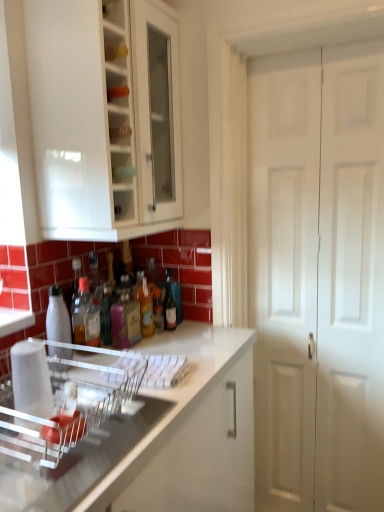
Measure the distance between point (85,291) and camera.

A distance of 1.50 meters exists between point (85,291) and camera.

What are the coordinates of `pink matte bottle at center, marked as the 4th bottle in a right-to-left arrangement` in the screenshot? It's located at (125, 317).

The height and width of the screenshot is (512, 384). Describe the element at coordinates (146, 306) in the screenshot. I see `translucent glass bottle at center, the fourth bottle viewed from the left` at that location.

In the scene shown: How much space does translucent glass bottle at center, the 3th bottle when ordered from right to left, occupy vertically?

It is 22.80 centimeters.

The height and width of the screenshot is (512, 384). What are the coordinates of `translucent plastic bottle at center, positioned as the 5th bottle in left-to-right order` in the screenshot? It's located at (158, 310).

The image size is (384, 512). Identify the location of clear plastic dish rack at center. (61, 401).

This screenshot has height=512, width=384. What do you see at coordinates (61, 401) in the screenshot? I see `clear plastic dish rack at center` at bounding box center [61, 401].

The width and height of the screenshot is (384, 512). What are the coordinates of `translucent plastic bottle at center, the second bottle in the left-to-right sequence` in the screenshot? It's located at (80, 311).

Considering the positions of objects translucent plastic bottle at center, the fifth bottle in the right-to-left sequence, and white glossy bottle at center, the 1th bottle from the left, in the image provided, who is behind, translucent plastic bottle at center, the fifth bottle in the right-to-left sequence, or white glossy bottle at center, the 1th bottle from the left,?

translucent plastic bottle at center, the fifth bottle in the right-to-left sequence.

Is there a large distance between translucent plastic bottle at center, the fifth bottle in the right-to-left sequence, and white glossy bottle at center, the 1th bottle from the left?

Actually, translucent plastic bottle at center, the fifth bottle in the right-to-left sequence, and white glossy bottle at center, the 1th bottle from the left, are a little close together.

Who is taller, translucent plastic bottle at center, the second bottle in the left-to-right sequence, or white glossy bottle at center, arranged as the sixth bottle when viewed from the right?

translucent plastic bottle at center, the second bottle in the left-to-right sequence.

Is translucent glass bottle at center, the 3th bottle when ordered from right to left, in contact with matte glass bottle at center, the sixth bottle when ordered from left to right?

Yes, translucent glass bottle at center, the 3th bottle when ordered from right to left, is right next to matte glass bottle at center, the sixth bottle when ordered from left to right, and making contact.

What's the angular difference between translucent glass bottle at center, the fourth bottle viewed from the left, and matte glass bottle at center, which appears as the first bottle when viewed from the right,'s facing directions?

The facing directions of translucent glass bottle at center, the fourth bottle viewed from the left, and matte glass bottle at center, which appears as the first bottle when viewed from the right, are 0.00762 degrees apart.

In terms of height, does translucent glass bottle at center, the 3th bottle when ordered from right to left, look taller or shorter compared to matte glass bottle at center, which appears as the first bottle when viewed from the right?

translucent glass bottle at center, the 3th bottle when ordered from right to left, is taller than matte glass bottle at center, which appears as the first bottle when viewed from the right.

Considering the points (144, 284) and (165, 300), which point is behind, point (144, 284) or point (165, 300)?

The point (165, 300) is farther.

Identify the location of appliance on the left side of matte glass bottle at center, which appears as the first bottle when viewed from the right. This screenshot has height=512, width=384. (61, 401).

Which point is more distant from viewer, (166, 300) or (113, 391)?

The point (166, 300) is farther.

Is matte glass bottle at center, the sixth bottle when ordered from left to right, in front of or behind clear plastic dish rack at center in the image?

In the image, matte glass bottle at center, the sixth bottle when ordered from left to right, appears behind clear plastic dish rack at center.

From the image's perspective, is clear plastic dish rack at lower left over clear plastic dish rack at center?

No.

Which point is more distant from viewer, (x=56, y=504) or (x=63, y=439)?

The point (x=63, y=439) is farther.

Between clear plastic dish rack at lower left and clear plastic dish rack at center, which one has smaller size?

With smaller size is clear plastic dish rack at center.

From a real-world perspective, which object rests below the other?

clear plastic dish rack at lower left is physically lower.

Considering the sizes of clear plastic dish rack at lower left and white glossy cabinet at upper left in the image, is clear plastic dish rack at lower left wider or thinner than white glossy cabinet at upper left?

Considering their sizes, clear plastic dish rack at lower left looks broader than white glossy cabinet at upper left.

Could you tell me if clear plastic dish rack at lower left is facing white glossy cabinet at upper left?

No, clear plastic dish rack at lower left is not oriented towards white glossy cabinet at upper left.

In the scene shown: Considering the relative positions of clear plastic dish rack at lower left and white glossy cabinet at upper left in the image provided, is clear plastic dish rack at lower left to the left or to the right of white glossy cabinet at upper left?

Clearly, clear plastic dish rack at lower left is on the left of white glossy cabinet at upper left in the image.

Is white matte door at right to the right of white glossy cabinet at upper left from the viewer's perspective?

Indeed, white matte door at right is positioned on the right side of white glossy cabinet at upper left.

From the image's perspective, is white matte door at right on white glossy cabinet at upper left?

Incorrect, from the image's perspective, white matte door at right is lower than white glossy cabinet at upper left.

How different are the orientations of white matte door at right and white glossy cabinet at upper left in degrees?

The facing directions of white matte door at right and white glossy cabinet at upper left are 90 degrees apart.

Considering the sizes of objects white matte door at right and white glossy cabinet at upper left in the image provided, who is thinner, white matte door at right or white glossy cabinet at upper left?

white matte door at right.

From the image's perspective, which one is positioned higher, translucent plastic bottle at center, which is counted as the second bottle, starting from the right, or pink matte bottle at center, the third bottle in the left-to-right sequence?

translucent plastic bottle at center, which is counted as the second bottle, starting from the right, is shown above in the image.

From a real-world perspective, relative to pink matte bottle at center, the third bottle in the left-to-right sequence, is translucent plastic bottle at center, which is counted as the second bottle, starting from the right, vertically above or below?

In terms of real-world spatial position, translucent plastic bottle at center, which is counted as the second bottle, starting from the right, is below pink matte bottle at center, the third bottle in the left-to-right sequence.

Is pink matte bottle at center, the third bottle in the left-to-right sequence, at the back of translucent plastic bottle at center, which is counted as the second bottle, starting from the right?

That's not correct — translucent plastic bottle at center, which is counted as the second bottle, starting from the right, is not looking away from pink matte bottle at center, the third bottle in the left-to-right sequence.

Consider the image. Is translucent plastic bottle at center, positioned as the 5th bottle in left-to-right order, further to the viewer compared to pink matte bottle at center, marked as the 4th bottle in a right-to-left arrangement?

Yes.

From a real-world perspective, which bottle is the 1st one underneath the translucent plastic bottle at center, the second bottle in the left-to-right sequence? Please provide its 2D coordinates.

[(57, 317)]

From the image's perspective, starting from the matte glass bottle at center, which appears as the first bottle when viewed from the right, which bottle is the 1st one above? Please provide its 2D coordinates.

[(146, 306)]

From the image, which object appears to be nearer to translucent plastic bottle at center, which is counted as the second bottle, starting from the right, translucent glass bottle at center, the fourth bottle viewed from the left, or translucent plastic bottle at center, the fifth bottle in the right-to-left sequence?

Among the two, translucent glass bottle at center, the fourth bottle viewed from the left, is located nearer to translucent plastic bottle at center, which is counted as the second bottle, starting from the right.

Estimate the real-world distances between objects in this image. Which object is closer to white glossy cabinet at upper left, white glossy bottle at center, arranged as the sixth bottle when viewed from the right, or matte glass bottle at center, the sixth bottle when ordered from left to right?

Among the two, white glossy bottle at center, arranged as the sixth bottle when viewed from the right, is located nearer to white glossy cabinet at upper left.

Looking at the image, which one is located further to clear plastic dish rack at lower left, translucent plastic bottle at center, the fifth bottle in the right-to-left sequence, or translucent plastic bottle at center, which is counted as the second bottle, starting from the right?

Among the two, translucent plastic bottle at center, the fifth bottle in the right-to-left sequence, is located further to clear plastic dish rack at lower left.

When comparing their distances from translucent plastic bottle at center, the fifth bottle in the right-to-left sequence, does clear plastic dish rack at center or matte glass bottle at center, the sixth bottle when ordered from left to right, seem closer?

matte glass bottle at center, the sixth bottle when ordered from left to right.

Based on their spatial positions, is translucent glass bottle at center, the 3th bottle when ordered from right to left, or translucent plastic bottle at center, the fifth bottle in the right-to-left sequence, further from clear plastic dish rack at center?

translucent glass bottle at center, the 3th bottle when ordered from right to left, lies further to clear plastic dish rack at center than the other object.

From the image, which object appears to be nearer to clear plastic dish rack at lower left, translucent plastic bottle at center, the fifth bottle in the right-to-left sequence, or white matte door at right?

Based on the image, translucent plastic bottle at center, the fifth bottle in the right-to-left sequence, appears to be nearer to clear plastic dish rack at lower left.

Looking at the image, which one is located closer to clear plastic dish rack at center, translucent plastic bottle at center, the fifth bottle in the right-to-left sequence, or pink matte bottle at center, the third bottle in the left-to-right sequence?

pink matte bottle at center, the third bottle in the left-to-right sequence.

Considering their positions, is translucent plastic bottle at center, the second bottle in the left-to-right sequence, positioned further to white glossy bottle at center, arranged as the sixth bottle when viewed from the right, than clear plastic dish rack at center?

clear plastic dish rack at center is further to white glossy bottle at center, arranged as the sixth bottle when viewed from the right.

Locate an element on the screen. This screenshot has height=512, width=384. appliance located between clear plastic dish rack at lower left and matte glass bottle at center, which appears as the first bottle when viewed from the right, in the depth direction is located at coordinates (61, 401).

I want to click on bottle situated between translucent glass bottle at center, the 3th bottle when ordered from right to left, and matte glass bottle at center, the sixth bottle when ordered from left to right, from left to right, so click(x=158, y=310).

I want to click on cabinetry between translucent plastic bottle at center, the fifth bottle in the right-to-left sequence, and white matte door at right from left to right, so click(x=16, y=134).

Find the location of a particular element. Image resolution: width=384 pixels, height=512 pixels. appliance located between clear plastic dish rack at lower left and translucent plastic bottle at center, which is counted as the second bottle, starting from the right, in the depth direction is located at coordinates (61, 401).